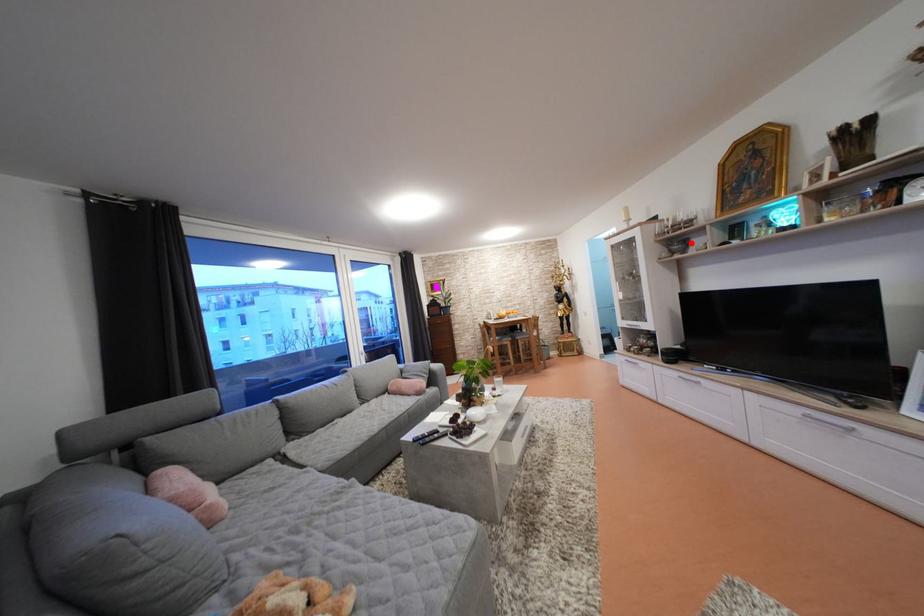
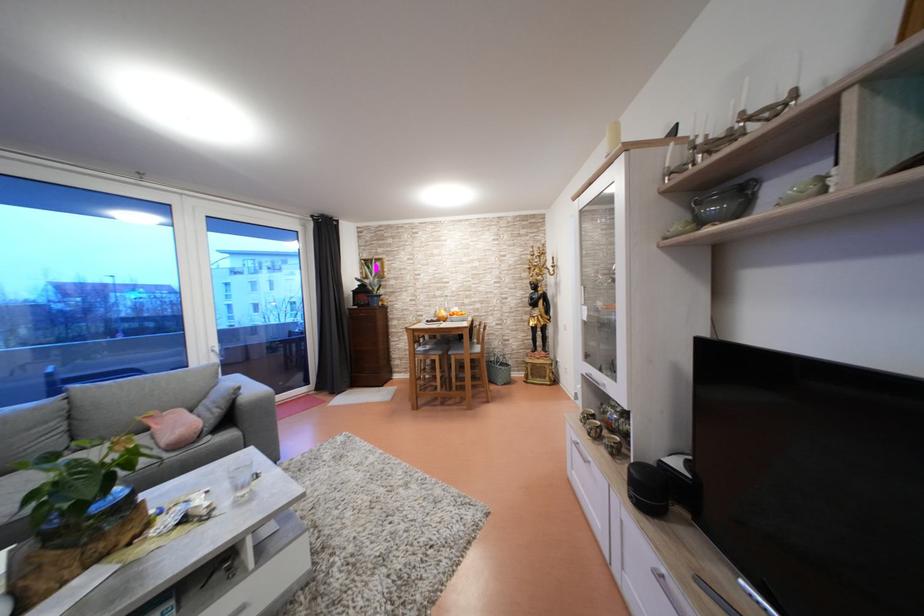
Find the pixel in the second image that matches the highlighted location in the first image.

(748, 185)